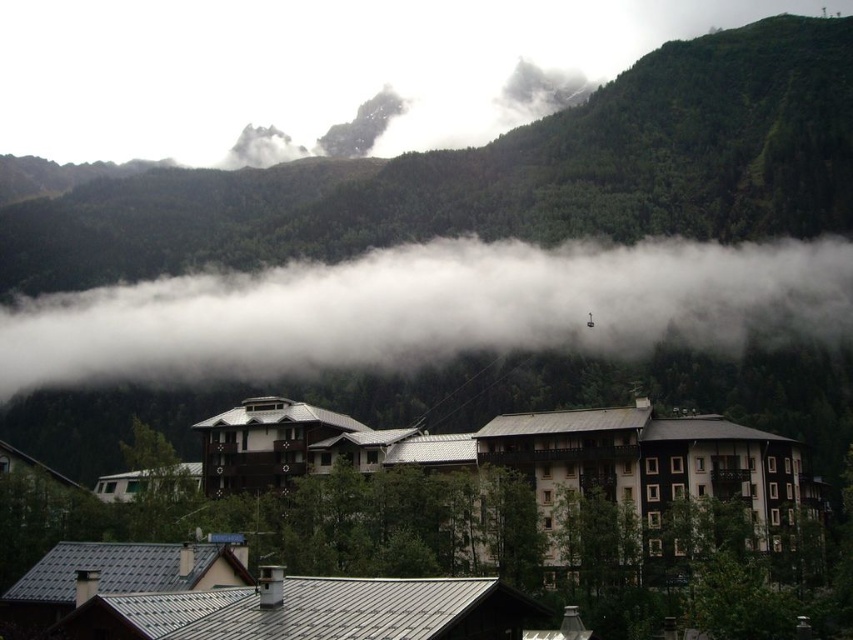
Describe the element at coordinates (577, 506) in the screenshot. I see `brown wooden building at center` at that location.

Who is more distant from viewer, (283, 618) or (154, 364)?

The point (154, 364) is behind.

You are a GUI agent. You are given a task and a screenshot of the screen. Output one action in this format:
    pyautogui.click(x=<x>, y=<y>)
    Task: Click on the brown wooden building at center
    The image size is (853, 640).
    Given the screenshot: What is the action you would take?
    pyautogui.click(x=577, y=506)